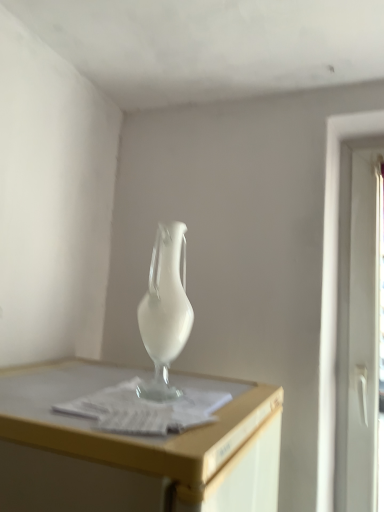
Question: In terms of size, does white plastic screen door at right appear bigger or smaller than satin white vase at center?

Choices:
 (A) small
 (B) big

Answer: (B)

Question: From their relative heights in the image, would you say white plastic screen door at right is taller or shorter than satin white vase at center?

Choices:
 (A) tall
 (B) short

Answer: (A)

Question: Which object is the farthest from the white plastic screen door at right?

Choices:
 (A) satin white vase at center
 (B) white paper at center

Answer: (B)

Question: Estimate the real-world distances between objects in this image. Which object is farther from the white plastic screen door at right?

Choices:
 (A) satin white vase at center
 (B) white paper at center

Answer: (B)